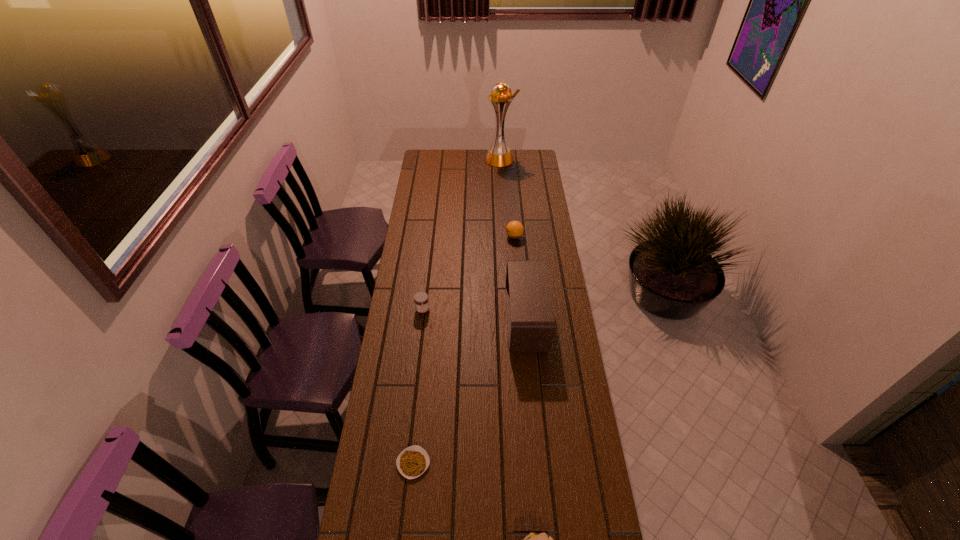
I want to click on blank space located on the front-facing side of the second tallest object, so click(x=453, y=321).

Locate an element on the screen. This screenshot has width=960, height=540. vacant space located on the front-facing side of the second tallest object is located at coordinates (450, 321).

Locate an element on the screen. The image size is (960, 540). vacant region located 0.050m on the front-facing side of the second tallest object is located at coordinates (494, 321).

Where is `free region located 0.280m on the side with brand of the ping-pong ball`? The width and height of the screenshot is (960, 540). free region located 0.280m on the side with brand of the ping-pong ball is located at coordinates (448, 237).

You are a GUI agent. You are given a task and a screenshot of the screen. Output one action in this format:
    pyautogui.click(x=<x>, y=<y>)
    Task: Click on the vacant space situated 0.350m on the side with brand of the ping-pong ball
    The image size is (960, 540).
    Given the screenshot: What is the action you would take?
    pyautogui.click(x=434, y=237)

I want to click on vacant area situated 0.360m on the side with brand of the ping-pong ball, so click(x=432, y=237).

This screenshot has height=540, width=960. Find the location of `vacant position located 0.140m on the right of the jam`. vacant position located 0.140m on the right of the jam is located at coordinates coord(464,310).

Where is `vacant region located 0.280m on the right of the shortest object`? vacant region located 0.280m on the right of the shortest object is located at coordinates (518, 463).

I want to click on object located at the far edge, so click(499, 155).

Where is `jam that is at the left edge`? This screenshot has height=540, width=960. jam that is at the left edge is located at coordinates (421, 300).